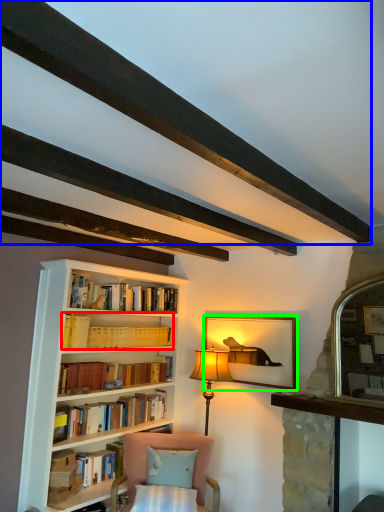
Question: Which object is the farthest from book (highlighted by a red box)? Choose among these: plank (highlighted by a blue box) or picture frame (highlighted by a green box).

Choices:
 (A) plank
 (B) picture frame

Answer: (A)